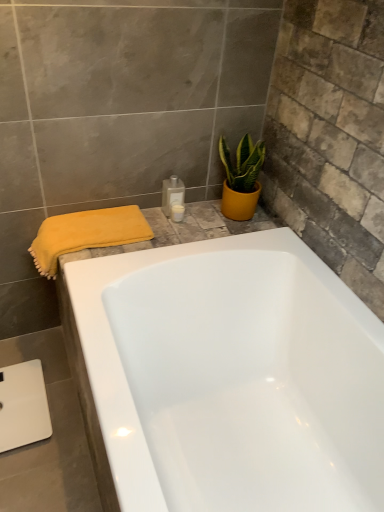
Where is `free space that is to the left of yellow matte pot at upper right`? Image resolution: width=384 pixels, height=512 pixels. free space that is to the left of yellow matte pot at upper right is located at coordinates (196, 219).